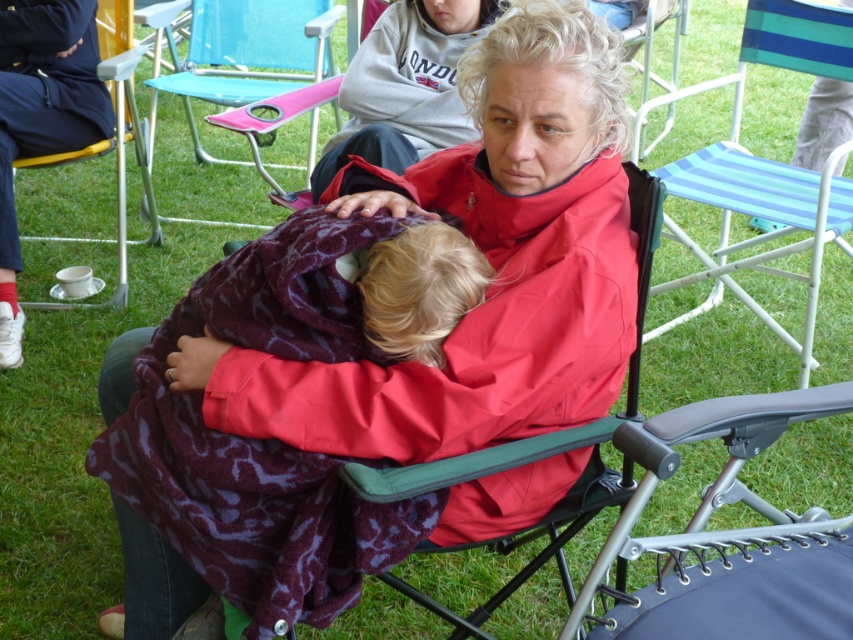
What do you see at coordinates (534, 454) in the screenshot?
I see `red fabric chair at center` at bounding box center [534, 454].

In the scene shown: Which is more to the left, red fabric chair at center or metallic silver cup at lower left?

metallic silver cup at lower left is more to the left.

Is point (425, 481) positioned in front of point (30, 304)?

That is True.

This screenshot has height=640, width=853. Find the location of `red fabric chair at center`. red fabric chair at center is located at coordinates (534, 454).

Is point (402, 372) positioned in front of point (367, 572)?

Yes, point (402, 372) is in front of point (367, 572).

Is matte red jacket at center shorter than maroon fleece blanket at center?

No, matte red jacket at center is not shorter than maroon fleece blanket at center.

Measure the distance between point (x=492, y=394) and camera.

1.47 meters

The image size is (853, 640). I want to click on matte red jacket at center, so click(486, 259).

Between blue striped fabric chair at center right and blonde hair at center, which one has more height?

blue striped fabric chair at center right is taller.

Does blue striped fabric chair at center right lie in front of blonde hair at center?

No, it is not.

The image size is (853, 640). What do you see at coordinates (767, 166) in the screenshot?
I see `blue striped fabric chair at center right` at bounding box center [767, 166].

Where is `blue striped fabric chair at center right`? The height and width of the screenshot is (640, 853). blue striped fabric chair at center right is located at coordinates (767, 166).